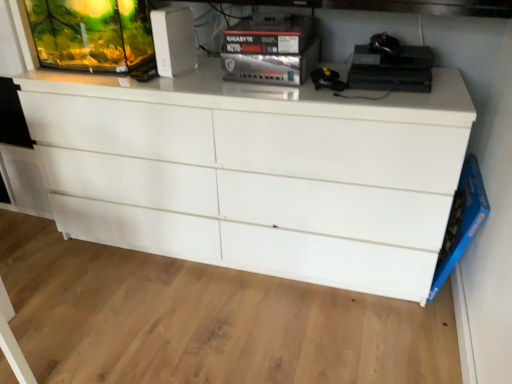
Question: Should I look upward or downward to see white plastic router at upper center?

Choices:
 (A) down
 (B) up

Answer: (B)